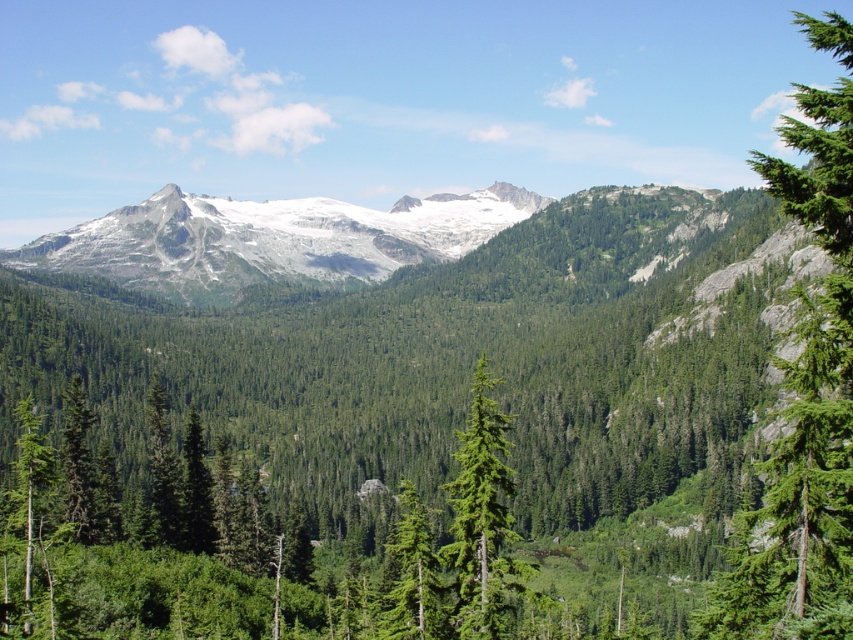
Question: Which object is closer to the camera taking this photo?

Choices:
 (A) green matte tree at lower left
 (B) white rocky mountain range at center
 (C) green needle-like tree at center

Answer: (A)

Question: Which point is farther to the camera?

Choices:
 (A) green matte tree at lower left
 (B) green textured tree at right
 (C) green matte tree at center

Answer: (C)

Question: Does green matte tree at lower left appear on the right side of green matte tree at center?

Choices:
 (A) no
 (B) yes

Answer: (A)

Question: Which object is positioned closest to the green needle-like tree at center?

Choices:
 (A) green matte tree at center
 (B) green textured tree at right

Answer: (A)

Question: Is green needle-like tree at center bigger than green matte tree at center?

Choices:
 (A) yes
 (B) no

Answer: (A)

Question: Is green textured tree at right wider than green matte tree at center?

Choices:
 (A) no
 (B) yes

Answer: (B)